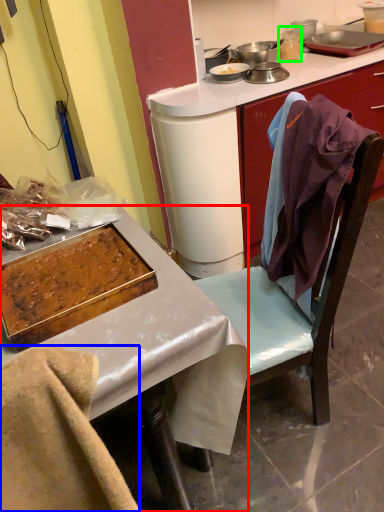
Question: Which object is positioned closest to desk (highlighted by a red box)? Select from leftover (highlighted by a blue box) and appliance (highlighted by a green box).

Choices:
 (A) leftover
 (B) appliance

Answer: (A)